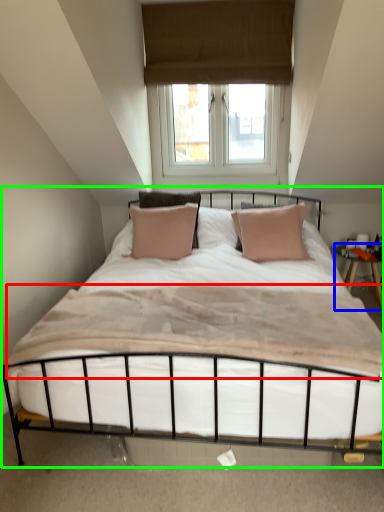
Question: Which object is the farthest from mattress (highlighted by a red box)? Choose among these: nightstand (highlighted by a blue box) or bed (highlighted by a green box).

Choices:
 (A) nightstand
 (B) bed

Answer: (A)